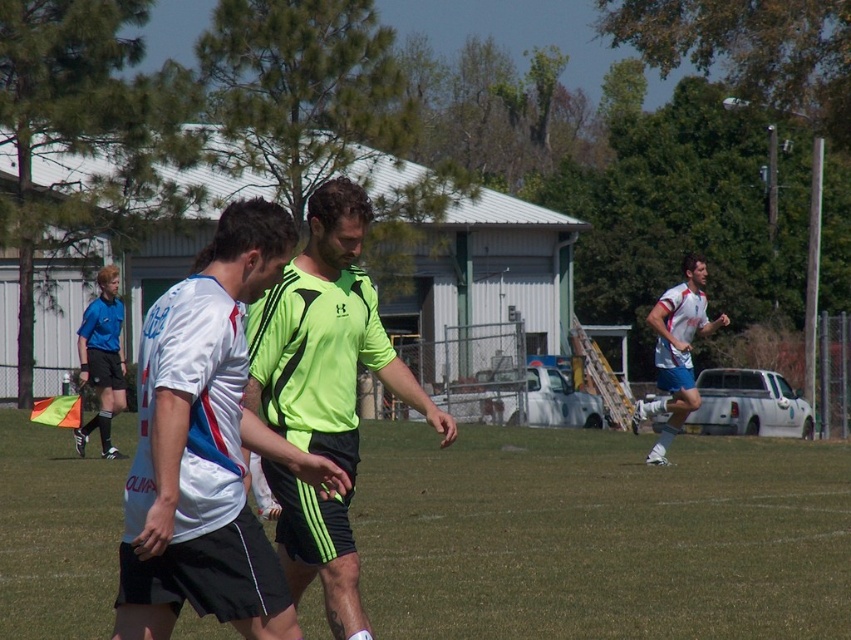
Question: Is neon green jersey at center to the left of white matte soccer player at right from the viewer's perspective?

Choices:
 (A) yes
 (B) no

Answer: (A)

Question: Is green grass football field at center further to the viewer compared to white matte soccer player at right?

Choices:
 (A) no
 (B) yes

Answer: (A)

Question: Where is neon green jersey at center located in relation to white matte soccer player at right in the image?

Choices:
 (A) left
 (B) right

Answer: (A)

Question: Among these objects, which one is farthest from the camera?

Choices:
 (A) white matte soccer player at right
 (B) neon green jersey at center

Answer: (A)

Question: Estimate the real-world distances between objects in this image. Which object is closer to the neon green jersey at center?

Choices:
 (A) green grass football field at center
 (B) white matte jersey at center

Answer: (B)

Question: Which point is closer to the camera?

Choices:
 (A) (266, 296)
 (B) (523, 522)
 (C) (267, 548)
 (D) (690, 403)

Answer: (C)